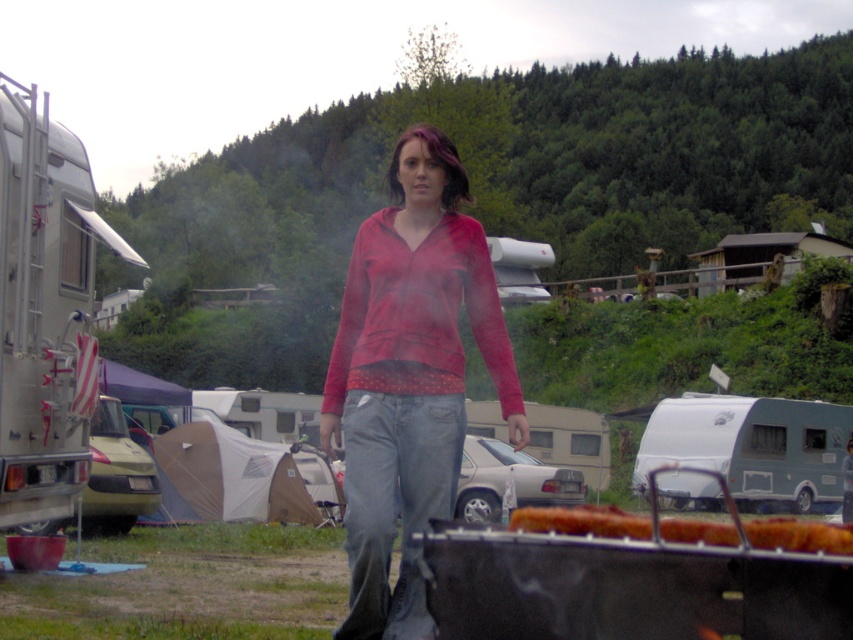
Is light blue plastic trailer at center to the right of tan canvas tent at lower left from the viewer's perspective?

Yes, light blue plastic trailer at center is to the right of tan canvas tent at lower left.

Does light blue plastic trailer at center appear on the left side of tan canvas tent at lower left?

In fact, light blue plastic trailer at center is to the right of tan canvas tent at lower left.

This screenshot has height=640, width=853. What are the coordinates of `light blue plastic trailer at center` in the screenshot? It's located at tap(750, 445).

From the picture: Between silver metallic trailer at left and silver metallic trailer at center, which one is positioned higher?

silver metallic trailer at left is higher up.

Does silver metallic trailer at left have a larger size compared to silver metallic trailer at center?

Indeed, silver metallic trailer at left has a larger size compared to silver metallic trailer at center.

Where is `silver metallic trailer at left`? silver metallic trailer at left is located at coordinates (45, 310).

Looking at this image, does tan canvas tent at lower left have a larger size compared to green matte van at left?

Indeed, tan canvas tent at lower left has a larger size compared to green matte van at left.

In the scene shown: Which is more to the right, tan canvas tent at lower left or green matte van at left?

tan canvas tent at lower left is more to the right.

This screenshot has height=640, width=853. What do you see at coordinates (236, 477) in the screenshot?
I see `tan canvas tent at lower left` at bounding box center [236, 477].

Identify the location of tan canvas tent at lower left. This screenshot has height=640, width=853. (236, 477).